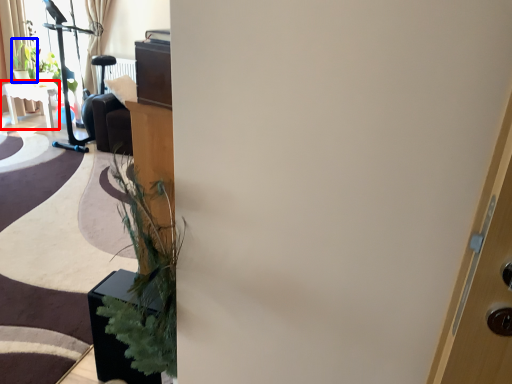
Question: Which point is closer to the camera, table (highlighted by a red box) or plant (highlighted by a blue box)?

Choices:
 (A) table
 (B) plant

Answer: (A)